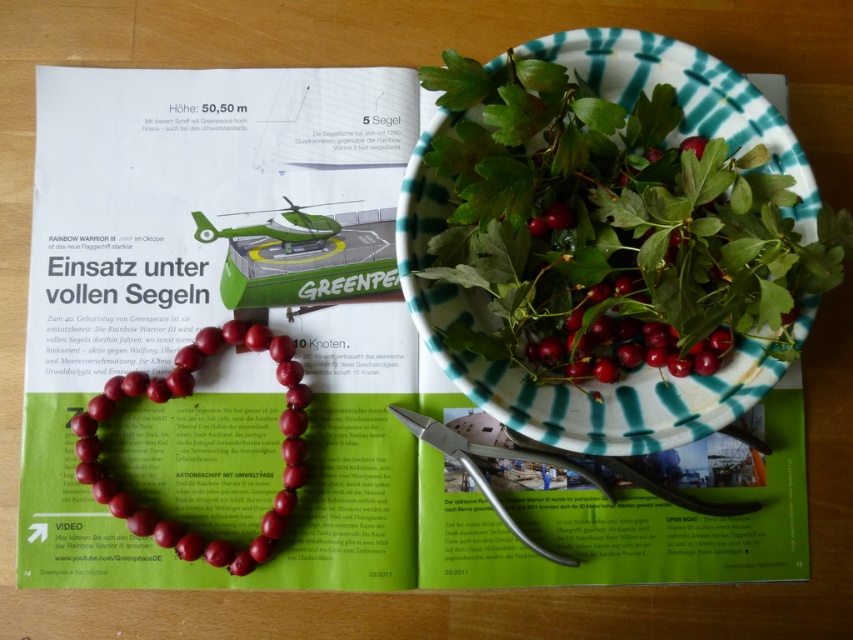
Between shiny ceramic bowl at upper right and metallic silver scissors at center, which one is positioned higher?

shiny ceramic bowl at upper right is higher up.

Can you confirm if shiny ceramic bowl at upper right is shorter than metallic silver scissors at center?

Incorrect, shiny ceramic bowl at upper right's height does not fall short of metallic silver scissors at center's.

What do you see at coordinates (563, 384) in the screenshot? I see `shiny ceramic bowl at upper right` at bounding box center [563, 384].

Find the location of a particular element. shiny ceramic bowl at upper right is located at coordinates (563, 384).

Who is taller, shiny ceramic bowl at upper right or shiny red berries at center?

With more height is shiny ceramic bowl at upper right.

Does shiny ceramic bowl at upper right have a greater height compared to shiny red berries at center?

Yes.

Is point (773, 172) more distant than point (705, 339)?

No, (773, 172) is closer to viewer.

Locate an element on the screen. shiny ceramic bowl at upper right is located at coordinates (563, 384).

Based on the photo, does shiny red beads at center appear under metallic silver scissors at center?

Incorrect, shiny red beads at center is not positioned below metallic silver scissors at center.

From the picture: Between shiny red beads at center and metallic silver scissors at center, which one is positioned lower?

metallic silver scissors at center is below.

This screenshot has height=640, width=853. What do you see at coordinates (184, 396) in the screenshot?
I see `shiny red beads at center` at bounding box center [184, 396].

This screenshot has width=853, height=640. I want to click on shiny red beads at center, so click(184, 396).